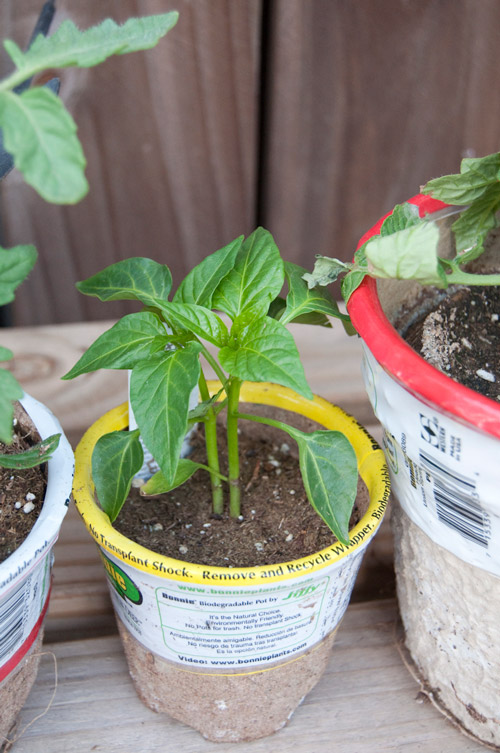
Locate an element on the screen. The width and height of the screenshot is (500, 753). left most planter is located at coordinates (22, 675).